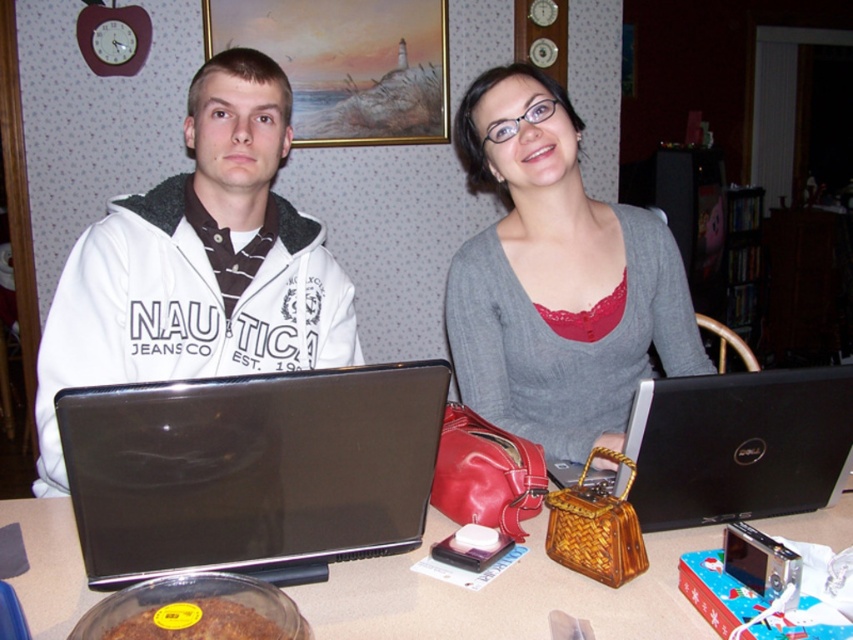
Question: Can you confirm if matte gray sweater at center is thinner than smooth brown table at center?

Choices:
 (A) no
 (B) yes

Answer: (B)

Question: Can you confirm if black glossy laptop at center is bigger than matte gray sweater at center?

Choices:
 (A) no
 (B) yes

Answer: (A)

Question: Based on their relative distances, which object is farther from the matte black laptop at left?

Choices:
 (A) white matte jacket at center
 (B) matte gray sweater at center
 (C) smooth brown table at center

Answer: (C)

Question: Which point appears farthest from the camera in this image?

Choices:
 (A) (486, 608)
 (B) (294, 250)
 (C) (521, 96)
 (D) (830, 397)

Answer: (B)

Question: Among these points, which one is farthest from the camera?

Choices:
 (A) (677, 362)
 (B) (297, 445)

Answer: (A)

Question: Does black glossy laptop at center have a greater width compared to black matte laptop at right?

Choices:
 (A) no
 (B) yes

Answer: (B)